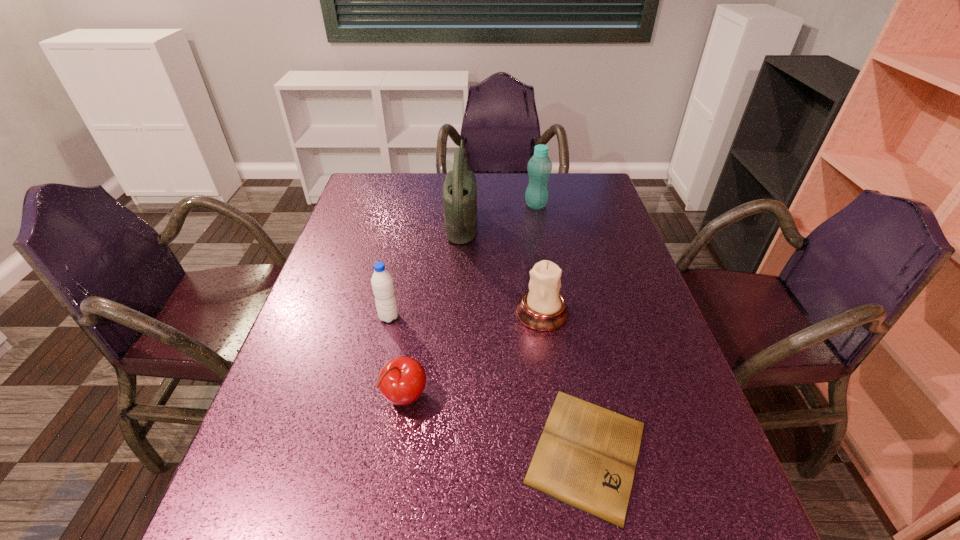
This screenshot has height=540, width=960. Find the location of `free location located on the back of the left water bottle`. free location located on the back of the left water bottle is located at coordinates (398, 273).

Locate an element on the screen. free space located 0.240m on the back of the candle holder is located at coordinates (531, 240).

This screenshot has width=960, height=540. What are the coordinates of `blank area located 0.100m on the front of the fifth tallest object` in the screenshot? It's located at (394, 472).

The width and height of the screenshot is (960, 540). Identify the location of vacant space located 0.050m on the left of the book. (492, 451).

Locate an element on the screen. The height and width of the screenshot is (540, 960). watering can that is at the far edge is located at coordinates (460, 186).

This screenshot has height=540, width=960. Find the location of `water bottle positioned at the far edge`. water bottle positioned at the far edge is located at coordinates click(x=539, y=167).

Where is `object present at the right edge`? This screenshot has width=960, height=540. object present at the right edge is located at coordinates (586, 457).

Where is `free space at the near edge`? This screenshot has height=540, width=960. free space at the near edge is located at coordinates (372, 537).

In order to click on vacant space at the left edge of the desktop in this screenshot , I will do tap(276, 416).

What are the coordinates of `free space at the right edge of the desktop` in the screenshot? It's located at (571, 219).